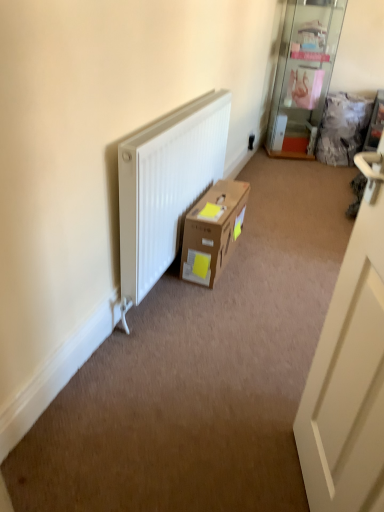
Where is `unoccupied space behind white matte door at right`? unoccupied space behind white matte door at right is located at coordinates (254, 395).